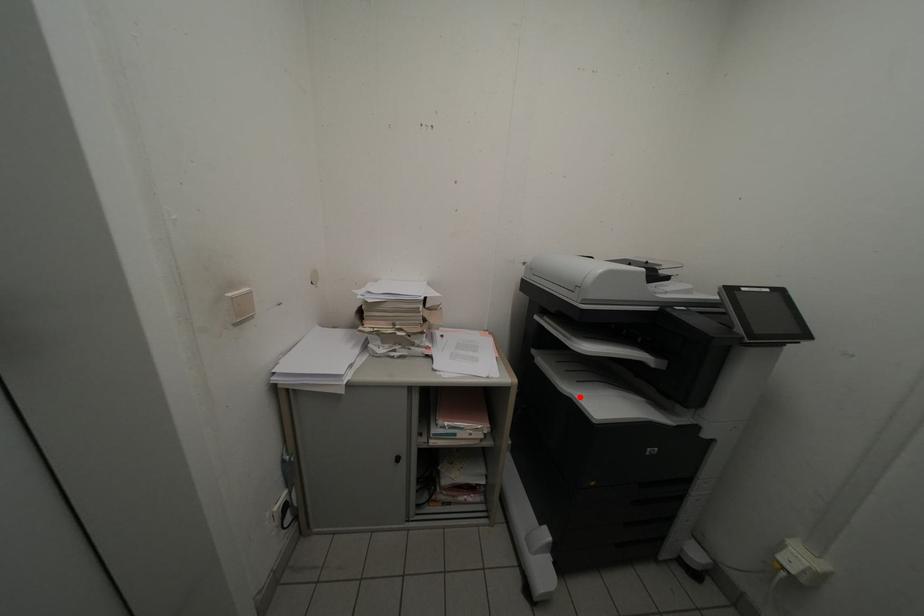
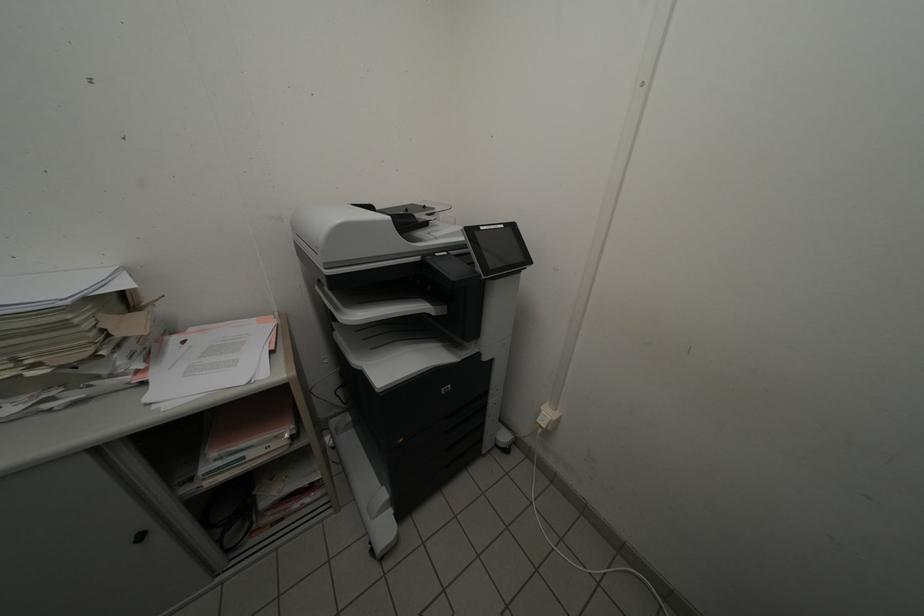
Where in the second image is the point corresponding to the highlighted location from the first image?

(370, 369)